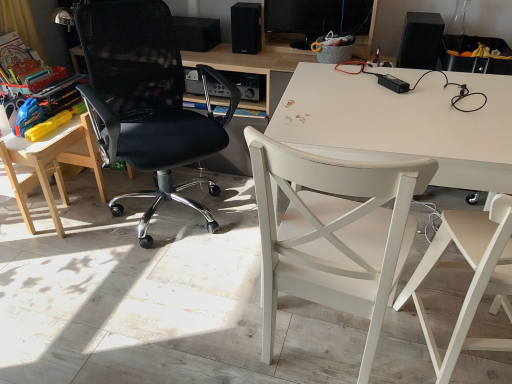
Where is `vacant space in front of light wood/wooden chair at left, the 4th chair from the right`? The width and height of the screenshot is (512, 384). vacant space in front of light wood/wooden chair at left, the 4th chair from the right is located at coordinates (29, 245).